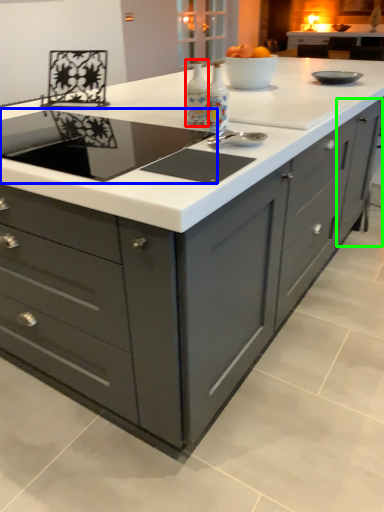
Question: Which object is the farthest from appliance (highlighted by a red box)? Choose among these: home appliance (highlighted by a blue box) or cabinetry (highlighted by a green box).

Choices:
 (A) home appliance
 (B) cabinetry

Answer: (B)